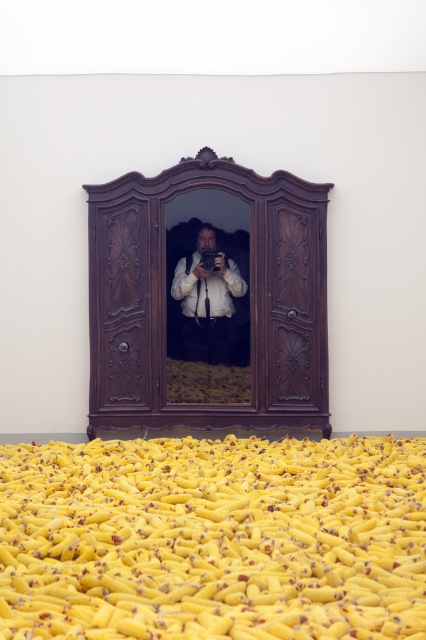
You are a photographer trying to capture the yellow matte banana at center and the white matte shirt at center in a single frame. Which object should you focus on first if you want to ensure both are in sharp focus?

The yellow matte banana at center is larger in size than the white matte shirt at center, so focusing on the larger object first would help ensure both are in sharp focus.

You are standing in a room with an ornate wooden armoire and a mirror reflecting a person. You see a yellow matte banana at center and a white matte shirt at center. Which object is nearer to you?

The yellow matte banana at center is closer to the viewer than the white matte shirt at center.

You are standing in a room with a polished dark wood armoire at center. Where is the polished dark wood armoire located?

The polished dark wood armoire at center is located at point (207, 300).